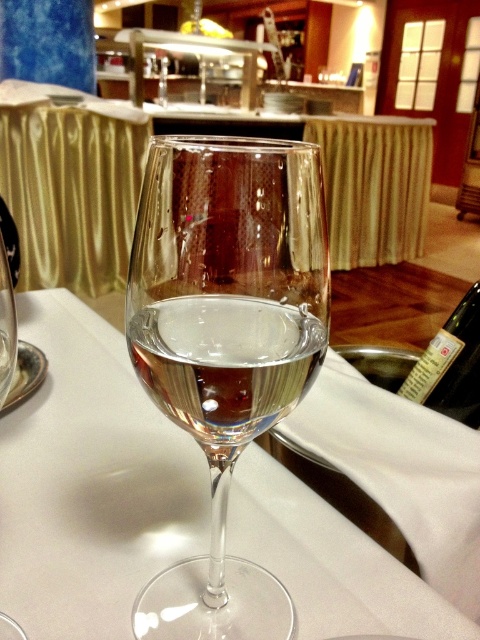
Which is in front, point (199, 202) or point (184, 380)?

Point (199, 202) is in front.

Does point (230, 266) come in front of point (135, 352)?

Yes, it is.

Is point (279, 636) positioned behind point (244, 401)?

Yes, point (279, 636) is behind point (244, 401).

This screenshot has width=480, height=640. Identify the location of clear glass wine glass at center. (226, 342).

Does clear glass wine glass at center appear on the right side of green glass bottle at lower right?

No, clear glass wine glass at center is not to the right of green glass bottle at lower right.

Which is more to the right, clear glass wine glass at center or green glass bottle at lower right?

green glass bottle at lower right

Is point (218, 625) less distant than point (437, 378)?

Yes, point (218, 625) is in front of point (437, 378).

Find the location of a particular element. This screenshot has height=640, width=480. clear glass wine glass at center is located at coordinates [226, 342].

Is transparent glass at center positioned before green glass bottle at lower right?

Yes, transparent glass at center is in front of green glass bottle at lower right.

Describe the element at coordinates (90, 483) in the screenshot. The image size is (480, 640). I see `transparent glass at center` at that location.

Find the location of a particular element. This screenshot has height=640, width=480. transparent glass at center is located at coordinates (90, 483).